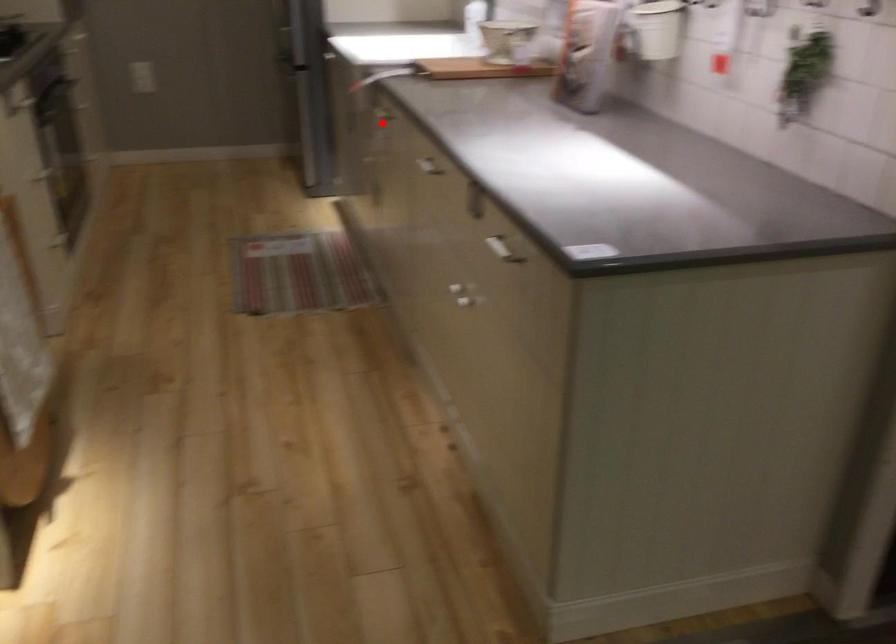
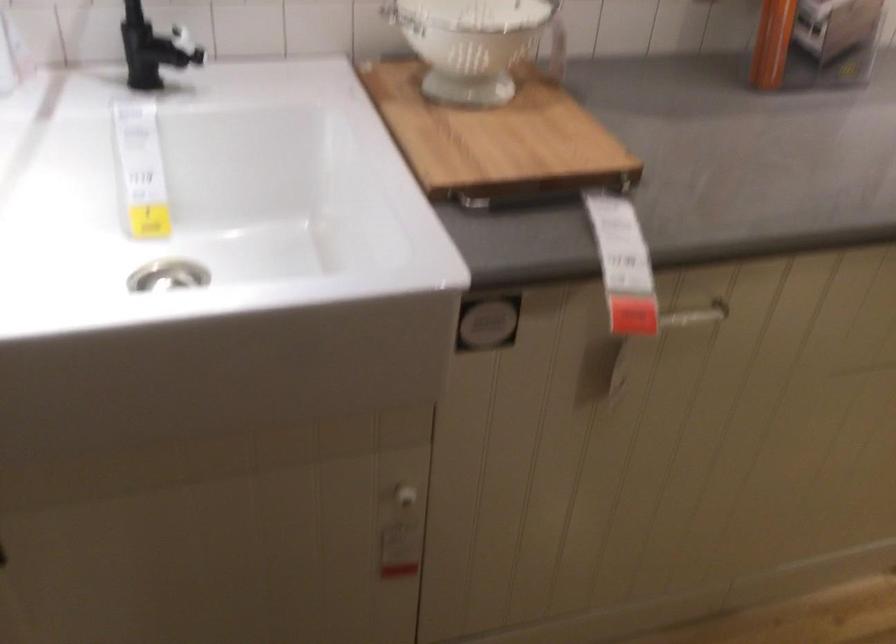
Question: I am providing you with two images of the same scene from different viewpoints. Given a red point in image1, look at the same physical point in image2. Is it:

Choices:
 (A) Closer to the viewpoint
 (B) Farther from the viewpoint

Answer: (A)